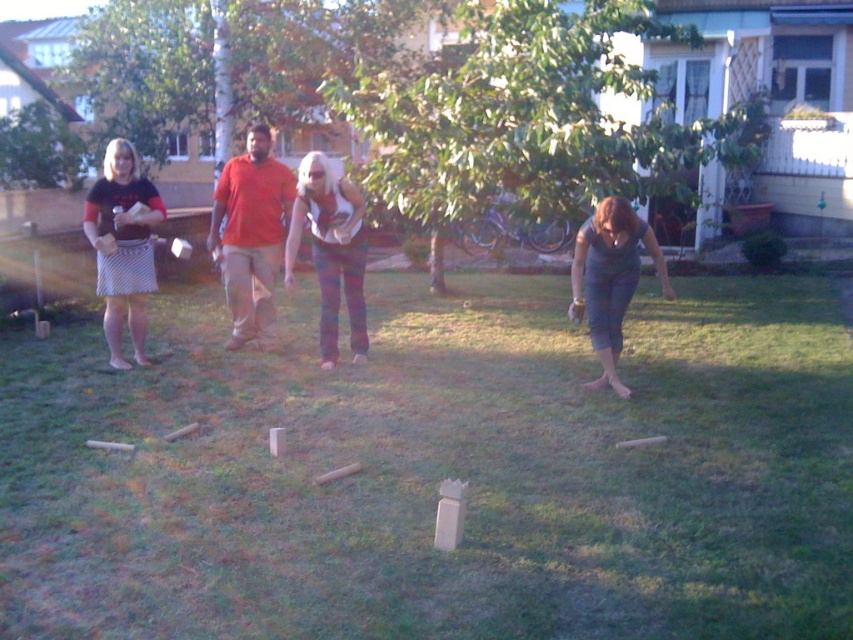
Based on the scene, which person is positioned higher in the image between the matte orange shirt at center and the matte gray tank top at lower right?

The matte orange shirt at center is positioned higher than the matte gray tank top at lower right in the image.

You are a delivery robot with a 3.5 feet wide package. You need to navigate from the green leafy tree at center to the matte gray tank top at lower right. Can you pass through the space between them?

The distance between the green leafy tree at center and the matte gray tank top at lower right is 8.14 feet. Since the package is 3.5 feet wide, there is enough space for the robot to pass through the gap between them.

You are a photographer trying to capture a candid shot of the matte orange shirt at center and the matte gray tank top at lower right. Since you want to highlight both subjects equally, which one should you zoom in on more to ensure they appear the same size in the photo?

The matte orange shirt at center is larger in size compared to the matte gray tank top at lower right. To make them appear the same size in the photo, you should zoom in more on the matte gray tank top at lower right while keeping the matte orange shirt at center at a standard zoom level.